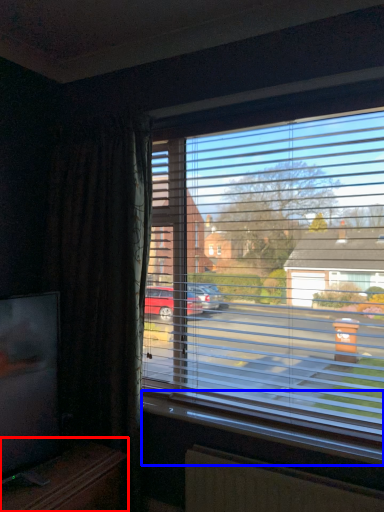
Question: Which point is closer to the camera, entertainment center (highlighted by a red box) or window sill (highlighted by a blue box)?

Choices:
 (A) entertainment center
 (B) window sill

Answer: (A)